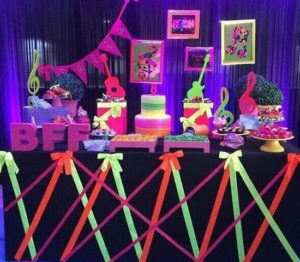
The height and width of the screenshot is (262, 300). I want to click on picture, so click(x=156, y=82).